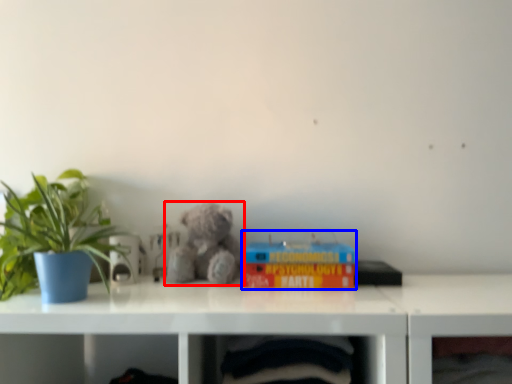
Question: Which of the following is the farthest to the observer, teddy bear (highlighted by a red box) or toy (highlighted by a blue box)?

Choices:
 (A) teddy bear
 (B) toy

Answer: (A)